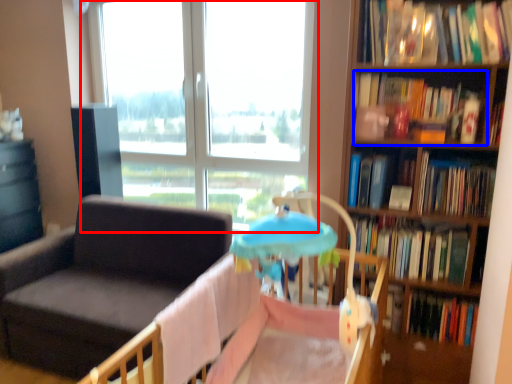
Question: Which object appears closest to the camera in this image, window (highlighted by a red box) or book (highlighted by a blue box)?

Choices:
 (A) window
 (B) book

Answer: (B)